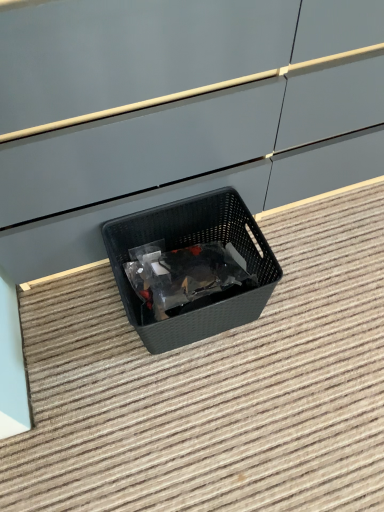
Image resolution: width=384 pixels, height=512 pixels. What are the coordinates of `blank space above black plastic basket at center (from a real-world perspective)` in the screenshot? It's located at (179, 396).